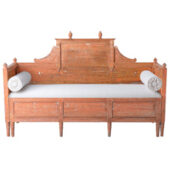
What are the coordinates of `bench` in the screenshot? It's located at (100, 75).